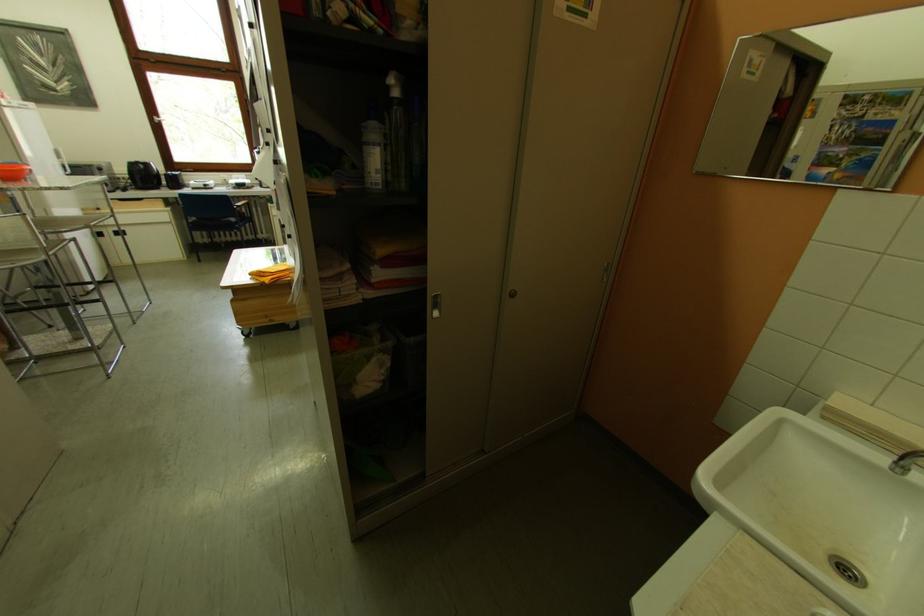
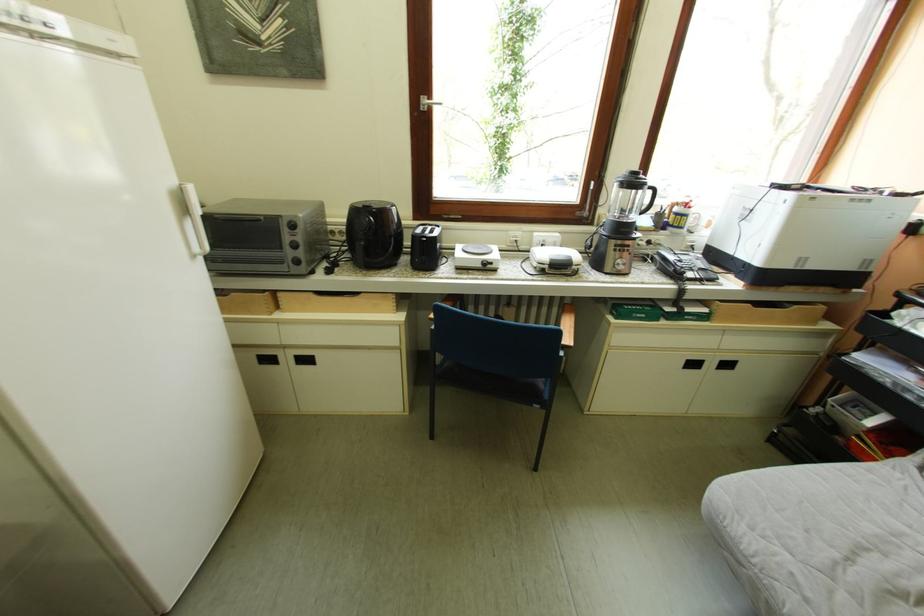
What movement of the cameraman would produce the second image?

The cameraman walked toward left, forward.